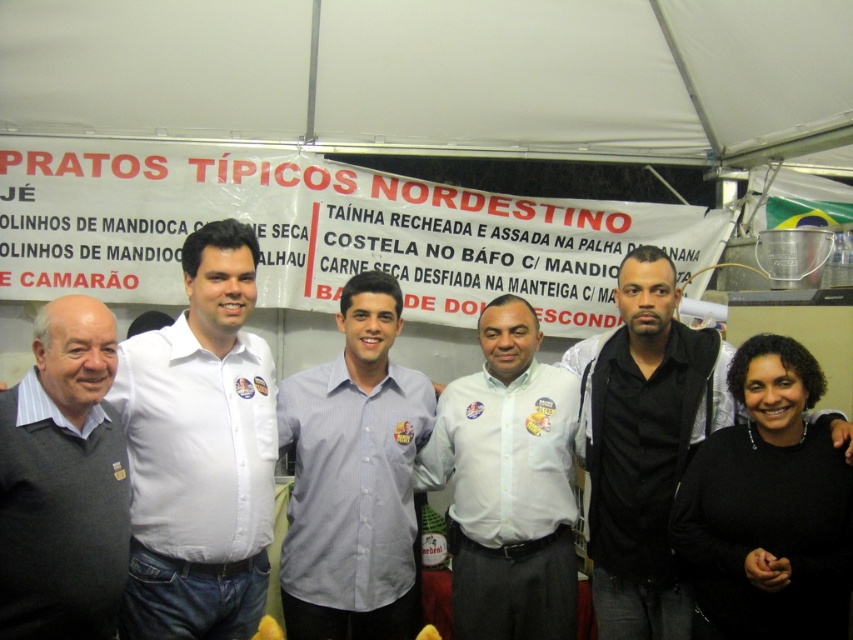
From the picture: You are organizing a photo shoot and need to arrange the white matte shirt at center and the gray sweater at left in a row from left to right. Based on their current positions, which order should they be placed in?

The gray sweater at left is on the left side of the white matte shirt at center, so the correct order from left to right should be gray sweater at left followed by white matte shirt at center.

You are a photographer setting up for a group photo under the white fabric canopy at upper center. You want to ensure that the white matte shirt at center is fully visible in the photo. Considering the possible width of the canopy, is there a risk that the canopy might block part of the shirt?

The white fabric canopy at upper center might be wider than the white matte shirt at center, so there is a possibility that the canopy could block part of the shirt. To ensure visibility, adjust the camera angle or position to avoid obstruction.

You are a photographer standing at the base of the tent. You want to take a photo that includes both the white fabric canopy at upper center and the white matte shirt at center. Since both are white, you need to ensure they are distinguishable in the photo. Given their distance apart, can you position yourself so that the two white objects are clearly separated in the image?

The white fabric canopy at upper center and white matte shirt at center are 5.70 feet apart from each other. At this distance, a photographer can position themselves to capture both objects while ensuring they are distinguishable in the photo due to their separation.